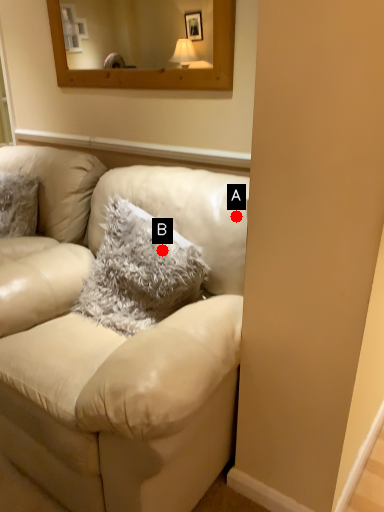
Question: Two points are circled on the image, labeled by A and B beside each circle. Among these points, which one is farthest from the camera?

Choices:
 (A) A is further
 (B) B is further

Answer: (B)